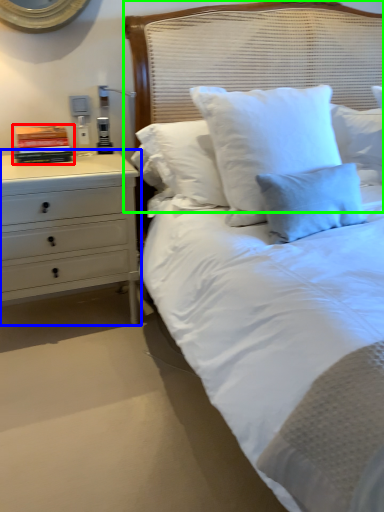
Question: Considering the real-world distances, which object is farthest from book (highlighted by a red box)? chest of drawers (highlighted by a blue box) or headboard (highlighted by a green box)?

Choices:
 (A) chest of drawers
 (B) headboard

Answer: (B)